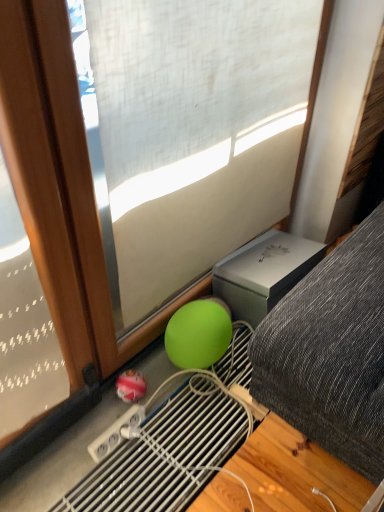
Describe the element at coordinates (198, 334) in the screenshot. The height and width of the screenshot is (512, 384). I see `green matte ball at center` at that location.

Identify the location of green matte ball at center. [x=198, y=334].

I want to click on green matte ball at center, so click(198, 334).